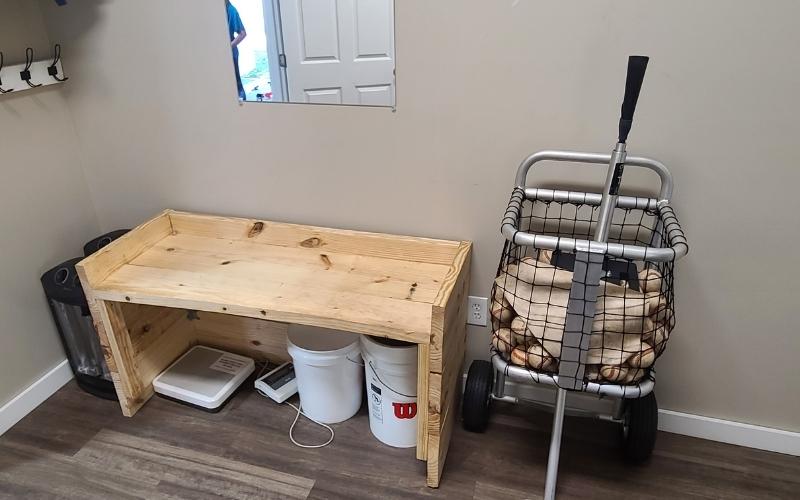
Find the location of a particular element. This screenshot has width=800, height=500. table is located at coordinates (334, 295).